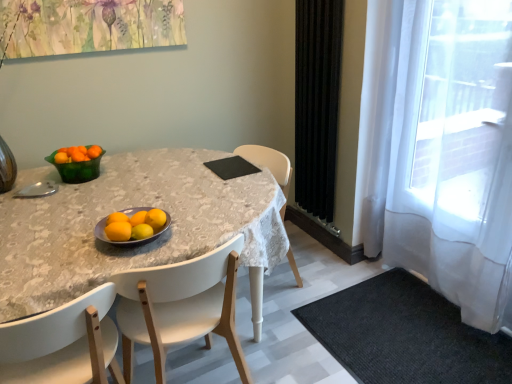
I want to click on vacant space situated on the left part of black matte pad at center, so click(x=199, y=167).